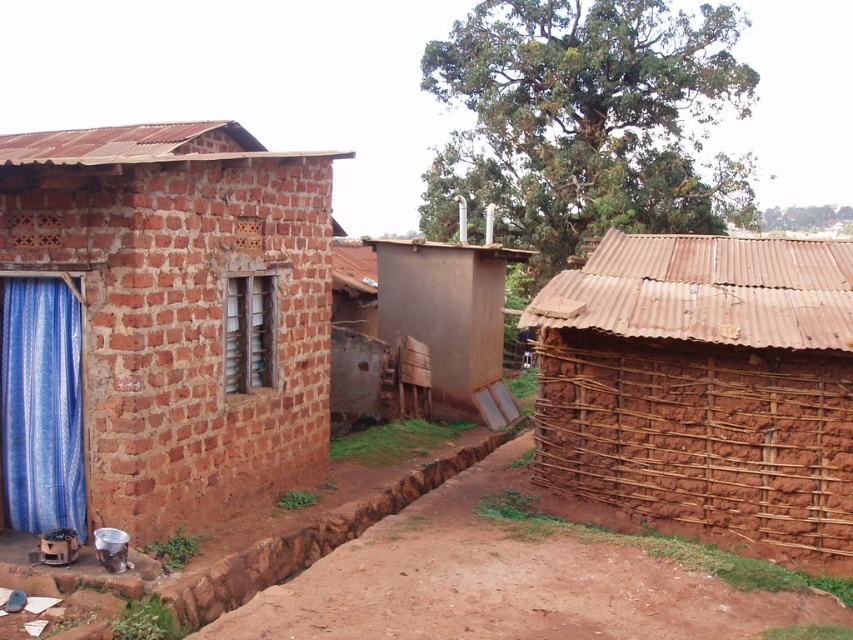
You are standing in the middle of the rural area and want to go to the brown mud hut at right. Which direction should you walk to reach it from the brown brick house at left?

The brown brick house at left is positioned over the brown mud hut at right, so you should walk to the right to reach the brown mud hut at right from the brown brick house at left.

You are a visitor standing in front of the scene. You notice the brown mud hut at right and the blue woven curtain at left. Which object is higher in height?

The brown mud hut at right is taller than the blue woven curtain at left.

You are standing in front of the brown brick house at left and the blue woven curtain at left. Which object is located to the left of the other?

The blue woven curtain at left is located to the left of the brown brick house at left because the brown brick house at left is positioned on the right side of the blue woven curtain at left.